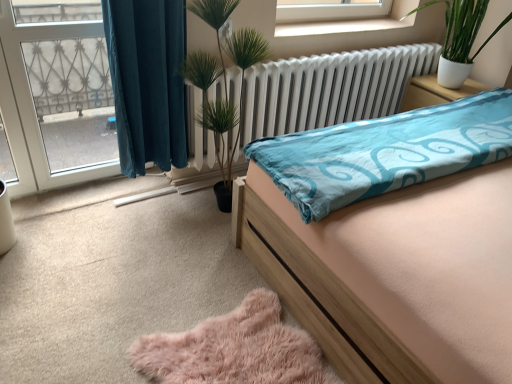
Question: From a real-world perspective, is white metallic radiator at center located higher than white glossy nightstand at upper right?

Choices:
 (A) yes
 (B) no

Answer: (A)

Question: Is white metallic radiator at center not within white glossy nightstand at upper right?

Choices:
 (A) yes
 (B) no

Answer: (A)

Question: Is white metallic radiator at center at the left side of white glossy nightstand at upper right?

Choices:
 (A) no
 (B) yes

Answer: (B)

Question: Would you say white metallic radiator at center contains white glossy nightstand at upper right?

Choices:
 (A) no
 (B) yes

Answer: (A)

Question: From the image's perspective, is white metallic radiator at center beneath white glossy nightstand at upper right?

Choices:
 (A) yes
 (B) no

Answer: (A)

Question: Does point (460, 54) appear closer or farther from the camera than point (159, 13)?

Choices:
 (A) farther
 (B) closer

Answer: (A)

Question: From the image's perspective, relative to teal fabric curtain at left, is green glossy plant at upper right above or below?

Choices:
 (A) above
 (B) below

Answer: (A)

Question: Considering the positions of green glossy plant at upper right and teal fabric curtain at left in the image, is green glossy plant at upper right wider or thinner than teal fabric curtain at left?

Choices:
 (A) wide
 (B) thin

Answer: (A)

Question: Considering the positions of green glossy plant at upper right and teal fabric curtain at left in the image, is green glossy plant at upper right bigger or smaller than teal fabric curtain at left?

Choices:
 (A) big
 (B) small

Answer: (A)

Question: Based on their sizes in the image, would you say teal fabric curtain at left is bigger or smaller than transparent glass door at left?

Choices:
 (A) small
 (B) big

Answer: (B)

Question: Looking at their shapes, would you say teal fabric curtain at left is wider or thinner than transparent glass door at left?

Choices:
 (A) wide
 (B) thin

Answer: (A)

Question: Would you say teal fabric curtain at left is to the left or to the right of transparent glass door at left in the picture?

Choices:
 (A) right
 (B) left

Answer: (A)

Question: From the image's perspective, is teal fabric curtain at left positioned above or below transparent glass door at left?

Choices:
 (A) below
 (B) above

Answer: (B)

Question: From their relative heights in the image, would you say wooden bed at center is taller or shorter than teal fabric curtain at left?

Choices:
 (A) short
 (B) tall

Answer: (A)

Question: Does point (358, 178) appear closer or farther from the camera than point (164, 132)?

Choices:
 (A) closer
 (B) farther

Answer: (A)